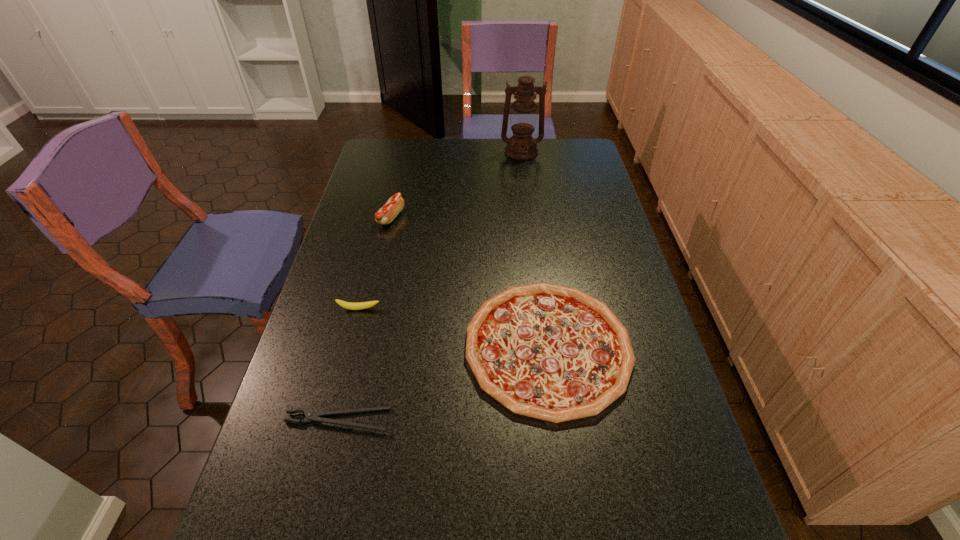
Find the location of a particular element. oil lamp is located at coordinates (521, 146).

This screenshot has width=960, height=540. I want to click on the tallest object, so click(521, 146).

The image size is (960, 540). I want to click on the fourth shortest object, so click(385, 215).

In order to click on the fourth nearest object in this screenshot , I will do `click(385, 215)`.

Locate an element on the screen. The width and height of the screenshot is (960, 540). the third shortest object is located at coordinates (347, 305).

I want to click on the fourth tallest object, so click(546, 351).

I want to click on the shortest object, so [311, 416].

Identify the location of blank area located 0.230m on the left of the oil lamp. (445, 152).

Where is `free space located 0.390m on the front of the sausage`? Image resolution: width=960 pixels, height=540 pixels. free space located 0.390m on the front of the sausage is located at coordinates (367, 322).

You are a GUI agent. You are given a task and a screenshot of the screen. Output one action in this format:
    pyautogui.click(x=<x>, y=<y>)
    Task: Click on the free location located 0.170m on the upward curve of the third tallest object
    The image size is (960, 540).
    Given the screenshot: What is the action you would take?
    pyautogui.click(x=345, y=363)